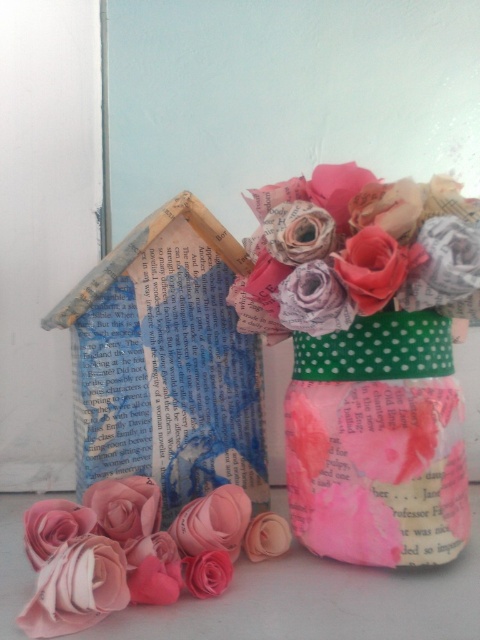
Is matte paper flower at center smaller than pink paper flower at lower left?

Incorrect, matte paper flower at center is not smaller in size than pink paper flower at lower left.

Which is more to the right, matte paper flower at center or pink paper flower at lower left?

matte paper flower at center is more to the right.

Is point (404, 216) positioned after point (24, 618)?

That is True.

Find the location of a particular element. matte paper flower at center is located at coordinates (356, 252).